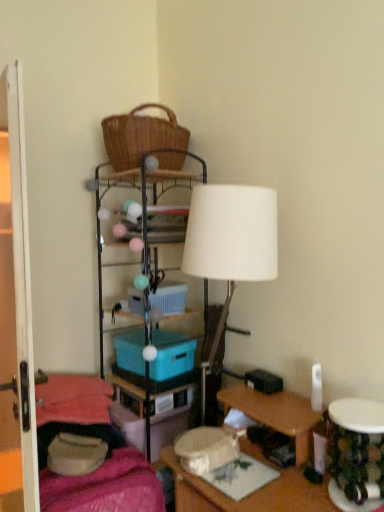
Where is `camouflage fabric table at lower right`? camouflage fabric table at lower right is located at coordinates (356, 454).

What is the approximate height of blue plastic storage box at center, arranged as the first storage box when viewed from the top?

It is 5.34 inches.

The height and width of the screenshot is (512, 384). What do you see at coordinates (144, 139) in the screenshot? I see `woven brown picnic basket at upper center` at bounding box center [144, 139].

The height and width of the screenshot is (512, 384). What do you see at coordinates (15, 306) in the screenshot?
I see `transparent glass door at left` at bounding box center [15, 306].

Find the location of a particular element. This screenshot has width=384, height=512. camouflage fabric table at lower right is located at coordinates (356, 454).

Which storage box is the 3rd one when counting from the left side of the white matte lamp at center? Please provide its 2D coordinates.

[(167, 429)]

Is white matte lamp at center turned away from teal plastic storage box at center, positioned as the 1th storage box in bottom-to-top order?

No, white matte lamp at center is not facing away from teal plastic storage box at center, positioned as the 1th storage box in bottom-to-top order.

From a real-world perspective, between white matte lamp at center and teal plastic storage box at center, which ranks as the 3th storage box in top-to-bottom order, who is vertically higher?

white matte lamp at center, from a real-world perspective.

Are white matte lamp at center and teal plastic storage box at center, which ranks as the 3th storage box in top-to-bottom order, making contact?

white matte lamp at center and teal plastic storage box at center, which ranks as the 3th storage box in top-to-bottom order, are not in contact.

Based on the photo, which point is more distant from viewer, (172, 335) or (52, 501)?

Positioned behind is point (172, 335).

Which is in front, blue plastic storage box at center, the second storage box positioned from the bottom, or velvet pink blanket at lower left?

velvet pink blanket at lower left is closer to the camera.

Would you say blue plastic storage box at center, the second storage box positioned from the bottom, contains velvet pink blanket at lower left?

No, velvet pink blanket at lower left is not surrounded by blue plastic storage box at center, the second storage box positioned from the bottom.

Is blue plastic storage box at center, the second storage box positioned from the bottom, positioned with its back to velvet pink blanket at lower left?

blue plastic storage box at center, the second storage box positioned from the bottom, is not turned away from velvet pink blanket at lower left.

Looking at the image, does velvet pink blanket at lower left seem bigger or smaller compared to blue plastic storage box at center, which is the 3th storage box from bottom to top?

Clearly, velvet pink blanket at lower left is larger in size than blue plastic storage box at center, which is the 3th storage box from bottom to top.

Which is behind, velvet pink blanket at lower left or blue plastic storage box at center, which is the 3th storage box from bottom to top?

blue plastic storage box at center, which is the 3th storage box from bottom to top, is behind.

Consider the image. From the image's perspective, which is below, velvet pink blanket at lower left or blue plastic storage box at center, which is the 3th storage box from bottom to top?

velvet pink blanket at lower left.

Which object is wider, velvet pink blanket at lower left or blue plastic storage box at center, which is the 3th storage box from bottom to top?

velvet pink blanket at lower left is wider.

Is woven brown picnic basket at upper center not inside wooden desk at lower right?

Indeed, woven brown picnic basket at upper center is completely outside wooden desk at lower right.

Between woven brown picnic basket at upper center and wooden desk at lower right, which one appears on the left side from the viewer's perspective?

From the viewer's perspective, woven brown picnic basket at upper center appears more on the left side.

Is woven brown picnic basket at upper center taller or shorter than wooden desk at lower right?

woven brown picnic basket at upper center is shorter than wooden desk at lower right.

Can you confirm if woven brown picnic basket at upper center is wider than wooden desk at lower right?

No.

In terms of width, does blue plastic storage box at center, which ranks as the 2th storage box in top-to-bottom order, look wider or thinner when compared to teal plastic storage box at center, which ranks as the 3th storage box in top-to-bottom order?

blue plastic storage box at center, which ranks as the 2th storage box in top-to-bottom order, is thinner than teal plastic storage box at center, which ranks as the 3th storage box in top-to-bottom order.

From a real-world perspective, is blue plastic storage box at center, the second storage box positioned from the bottom, positioned above or below teal plastic storage box at center, which ranks as the 3th storage box in top-to-bottom order?

blue plastic storage box at center, the second storage box positioned from the bottom, is situated higher than teal plastic storage box at center, which ranks as the 3th storage box in top-to-bottom order, in the real world.

Between blue plastic storage box at center, the second storage box positioned from the bottom, and teal plastic storage box at center, positioned as the 1th storage box in bottom-to-top order, which one appears on the right side from the viewer's perspective?

Positioned to the right is blue plastic storage box at center, the second storage box positioned from the bottom.

Considering the sizes of objects blue plastic storage box at center, which ranks as the 2th storage box in top-to-bottom order, and teal plastic storage box at center, positioned as the 1th storage box in bottom-to-top order, in the image provided, who is shorter, blue plastic storage box at center, which ranks as the 2th storage box in top-to-bottom order, or teal plastic storage box at center, positioned as the 1th storage box in bottom-to-top order,?

blue plastic storage box at center, which ranks as the 2th storage box in top-to-bottom order, is shorter.

Considering the relative sizes of transparent glass door at left and metallic wire shelf at center in the image provided, is transparent glass door at left smaller than metallic wire shelf at center?

Result: Yes.

Considering the relative positions of transparent glass door at left and metallic wire shelf at center in the image provided, is transparent glass door at left to the right of metallic wire shelf at center from the viewer's perspective?

Incorrect, transparent glass door at left is not on the right side of metallic wire shelf at center.

The width and height of the screenshot is (384, 512). What are the coordinates of `glass door in front of the metallic wire shelf at center` in the screenshot? It's located at coord(15,306).

Can you confirm if transparent glass door at left is wider than metallic wire shelf at center?

No.

Looking at this image, who is bigger, blue plastic storage box at center, the second storage box positioned from the bottom, or wooden desk at lower right?

Bigger between the two is wooden desk at lower right.

From the image's perspective, which storage box is the 2nd one above the wooden desk at lower right? Please provide its 2D coordinates.

[(171, 355)]

Is blue plastic storage box at center, the second storage box positioned from the bottom, aimed at wooden desk at lower right?

No, blue plastic storage box at center, the second storage box positioned from the bottom, does not turn towards wooden desk at lower right.

Between blue plastic storage box at center, which ranks as the 2th storage box in top-to-bottom order, and wooden desk at lower right, which one has larger width?

wooden desk at lower right is wider.

In order to click on lamp above the teal plastic storage box at center, which ranks as the 3th storage box in top-to-bottom order (from a real-world perspective) in this screenshot , I will do `click(230, 244)`.

Locate an element on the screen. The image size is (384, 512). bedding below the blue plastic storage box at center, the second storage box positioned from the bottom (from the image's perspective) is located at coordinates (105, 487).

Based on their spatial positions, is white matte lamp at center or teal plastic storage box at center, which ranks as the 3th storage box in top-to-bottom order, closer to transparent glass door at left?

Based on the image, white matte lamp at center appears to be nearer to transparent glass door at left.

When comparing their distances from wooden desk at lower right, does blue plastic storage box at center, which is the 3th storage box from bottom to top, or woven brown picnic basket at upper center seem closer?

blue plastic storage box at center, which is the 3th storage box from bottom to top, is positioned closer to the anchor wooden desk at lower right.

Which object lies further to the anchor point white matte lamp at center, transparent glass door at left or camouflage fabric table at lower right?

transparent glass door at left.

Estimate the real-world distances between objects in this image. Which object is further from metallic wire shelf at center, camouflage fabric table at lower right or blue plastic storage box at center, the second storage box positioned from the bottom?

camouflage fabric table at lower right is further to metallic wire shelf at center.

When comparing their distances from teal plastic storage box at center, which ranks as the 3th storage box in top-to-bottom order, does velvet pink blanket at lower left or blue plastic storage box at center, the second storage box positioned from the bottom, seem further?

velvet pink blanket at lower left is positioned further to the anchor teal plastic storage box at center, which ranks as the 3th storage box in top-to-bottom order.

Based on their spatial positions, is blue plastic storage box at center, the second storage box positioned from the bottom, or teal plastic storage box at center, positioned as the 1th storage box in bottom-to-top order, closer to velvet pink blanket at lower left?

teal plastic storage box at center, positioned as the 1th storage box in bottom-to-top order, is positioned closer to the anchor velvet pink blanket at lower left.

Which object lies nearer to the anchor point blue plastic storage box at center, the second storage box positioned from the bottom, metallic wire shelf at center or teal plastic storage box at center, positioned as the 1th storage box in bottom-to-top order?

metallic wire shelf at center.

From the image, which object appears to be nearer to blue plastic storage box at center, which is the 3th storage box from bottom to top, woven brown picnic basket at upper center or white matte lamp at center?

white matte lamp at center is closer to blue plastic storage box at center, which is the 3th storage box from bottom to top.

This screenshot has width=384, height=512. Identify the location of round table between wooden desk at lower right and teal plastic storage box at center, positioned as the 1th storage box in bottom-to-top order, in the front-back direction. (356, 454).

Where is `storage box between blue plastic storage box at center, arranged as the first storage box when viewed from the top, and teal plastic storage box at center, which ranks as the 3th storage box in top-to-bottom order, in the up-down direction`? storage box between blue plastic storage box at center, arranged as the first storage box when viewed from the top, and teal plastic storage box at center, which ranks as the 3th storage box in top-to-bottom order, in the up-down direction is located at coordinates (171, 355).

Locate an element on the screen. This screenshot has height=512, width=384. storage box between blue plastic storage box at center, which is the 3th storage box from bottom to top, and metallic wire shelf at center, in the vertical direction is located at coordinates (171, 355).

Find the location of a particular element. bedding situated between transparent glass door at left and wooden desk at lower right from left to right is located at coordinates click(x=105, y=487).